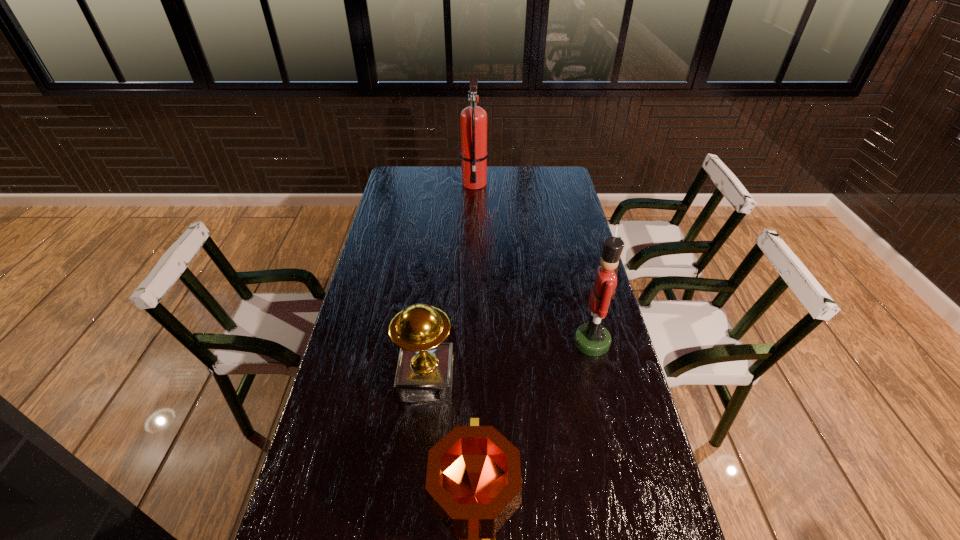
Where is `object at the right edge`? Image resolution: width=960 pixels, height=540 pixels. object at the right edge is located at coordinates (592, 339).

Locate an element on the screen. vacant space at the far edge of the desktop is located at coordinates 441,190.

This screenshot has width=960, height=540. Identify the location of vacant space at the left edge of the desktop. (369, 292).

Locate an element on the screen. This screenshot has width=960, height=540. free space at the right edge of the desktop is located at coordinates (596, 475).

In the image, there is a desktop. Where is `vacant space at the far left corner`? vacant space at the far left corner is located at coordinates (403, 178).

You are a GUI agent. You are given a task and a screenshot of the screen. Output one action in this format:
    pyautogui.click(x=<x>, y=<y>)
    Task: Click on the free space between the nutcracker and the fire extinguisher
    
    Given the screenshot: What is the action you would take?
    pyautogui.click(x=533, y=262)

Locate an element on the screen. empty space between the second farthest object and the second nearest object is located at coordinates (509, 361).

Identify the location of free space between the fire extinguisher and the farther award. (450, 282).

In order to click on free spot between the second nearest object and the farthest object in this screenshot , I will do `click(450, 282)`.

Identify which object is the third nearest to the fire extinguisher. Please provide its 2D coordinates. Your answer should be formatted as a tuple, i.e. [(x, y)], where the tuple contains the x and y coordinates of a point satisfying the conditions above.

[(473, 484)]